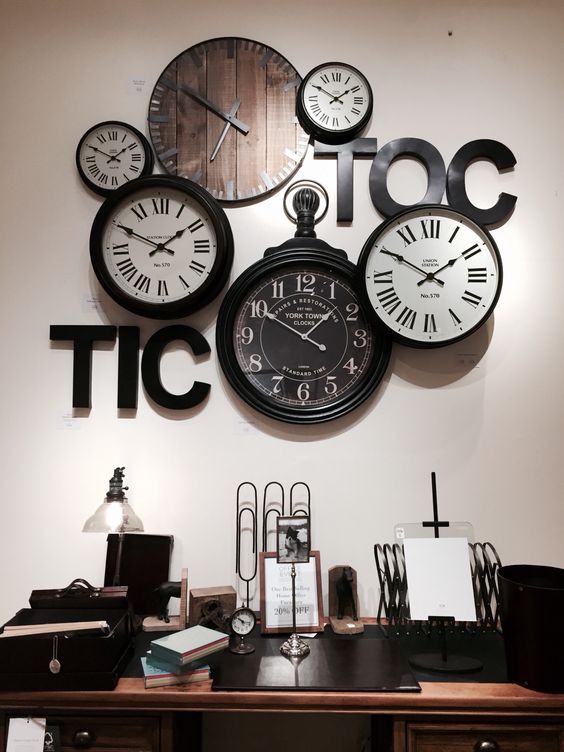
Where is `clocks with roman numerals`? This screenshot has width=564, height=752. clocks with roman numerals is located at coordinates (431, 274), (329, 92), (118, 153), (146, 247).